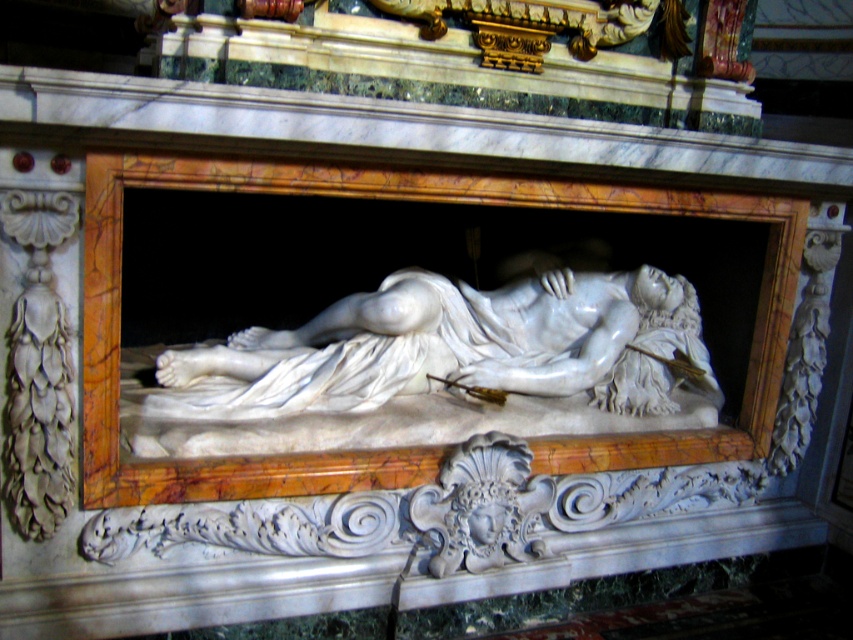
Based on the photo, is white marble statue at center below white marble mask at center?

No, white marble statue at center is not below white marble mask at center.

Can you confirm if white marble statue at center is smaller than white marble mask at center?

No, white marble statue at center is not smaller than white marble mask at center.

Where is `white marble statue at center`? The image size is (853, 640). white marble statue at center is located at coordinates (451, 348).